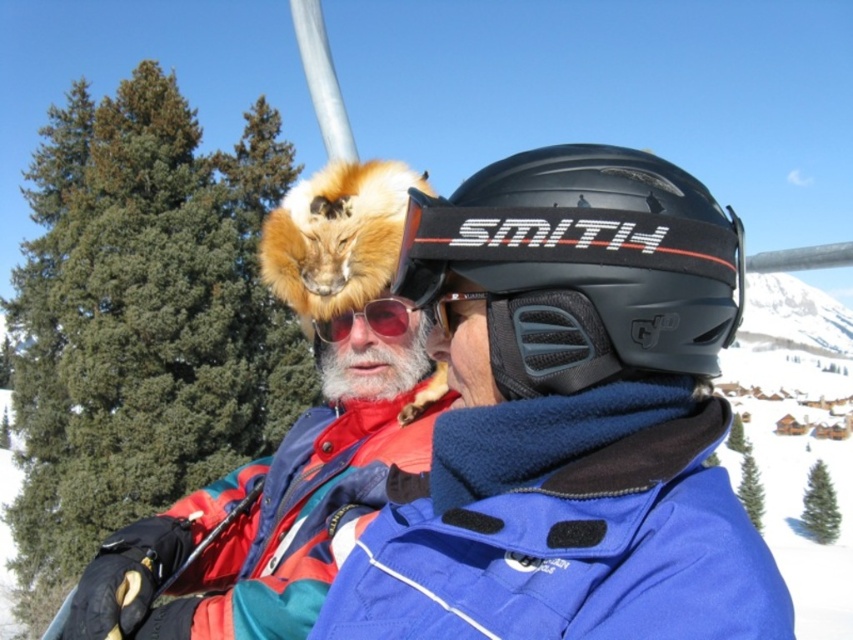
Question: Can you confirm if blue fleece jacket at center is smaller than fuzzy fur hat at upper left?

Choices:
 (A) no
 (B) yes

Answer: (B)

Question: Which object is farther from the camera taking this photo?

Choices:
 (A) blue fleece jacket at center
 (B) fuzzy fur hat at upper left
 (C) black matte helmet at center

Answer: (B)

Question: Does fuzzy fur hat at upper left appear on the right side of matte black goggles at center?

Choices:
 (A) yes
 (B) no

Answer: (B)

Question: Which object appears closest to the camera in this image?

Choices:
 (A) matte black goggles at center
 (B) red reflective lens goggles at center
 (C) black matte helmet at center
 (D) fuzzy fur hat at upper left

Answer: (C)

Question: From the image, what is the correct spatial relationship of black matte helmet at center in relation to red reflective lens goggles at center?

Choices:
 (A) below
 (B) above

Answer: (B)

Question: Which of the following is the farthest from the observer?

Choices:
 (A) red reflective lens goggles at center
 (B) black matte helmet at center
 (C) fuzzy fur hat at upper left

Answer: (A)